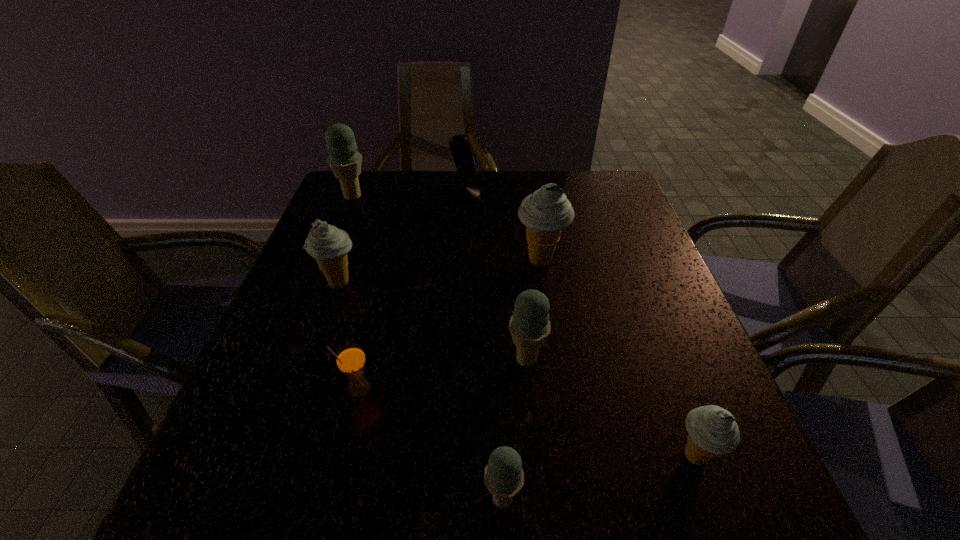
The image size is (960, 540). I want to click on the second beige icecream from left to right, so click(545, 213).

At what (x,y) coordinates should I click in order to perform the action: click on the biggest blue ice cream. Please return your answer as a coordinate pair (x, y). The image size is (960, 540). Looking at the image, I should click on (345, 161).

Locate an element on the screen. The width and height of the screenshot is (960, 540). the farthest blue ice cream is located at coordinates (345, 161).

The image size is (960, 540). I want to click on microphone, so click(x=465, y=162).

Where is `the fifth object from right to left`? the fifth object from right to left is located at coordinates (465, 162).

Where is `the leftmost beige icecream`? The height and width of the screenshot is (540, 960). the leftmost beige icecream is located at coordinates (329, 245).

Identify the location of the fifth farthest object. (529, 326).

Locate an element on the screen. the third nearest ice cream is located at coordinates (529, 326).

Locate an element on the screen. the third object from left to right is located at coordinates (350, 358).

You are a GUI agent. You are given a task and a screenshot of the screen. Output one action in this format:
    pyautogui.click(x=<x>, y=<y>)
    Task: Click on the third nearest object
    
    Given the screenshot: What is the action you would take?
    pyautogui.click(x=350, y=358)